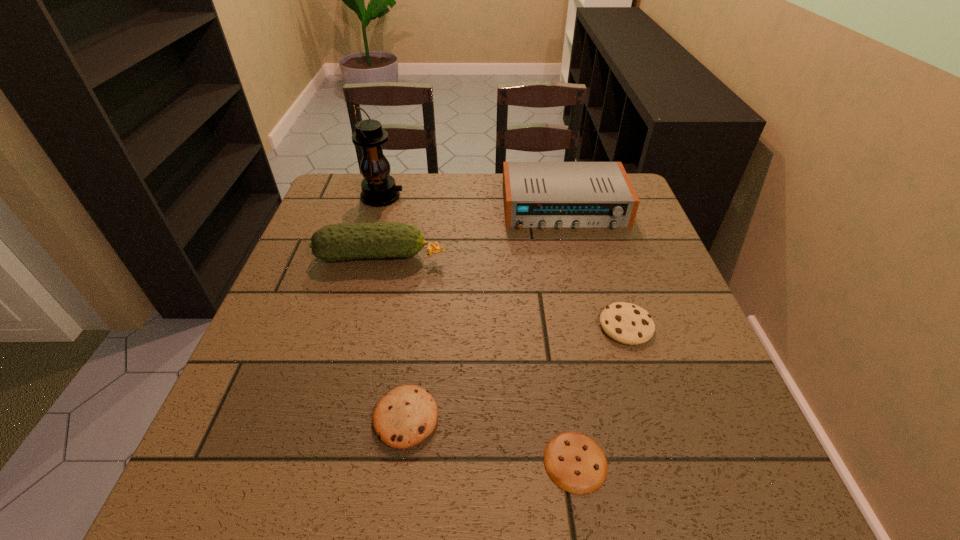
Image resolution: width=960 pixels, height=540 pixels. Find the location of `blank region between the third farthest object and the shortest object`. blank region between the third farthest object and the shortest object is located at coordinates (478, 360).

The width and height of the screenshot is (960, 540). I want to click on free point between the radio receiver and the second cookie from left to right, so click(569, 335).

Locate an element on the screen. This screenshot has height=540, width=960. free space between the lantern and the radio receiver is located at coordinates (473, 202).

You are a GUI agent. You are given a task and a screenshot of the screen. Output one action in this format:
    pyautogui.click(x=<x>, y=<y>)
    Task: Click on the free space between the shortest cookie and the radio receiver
    
    Given the screenshot: What is the action you would take?
    pyautogui.click(x=569, y=335)

Find the location of `vacant space that's between the radio receiver and the shortest object`. vacant space that's between the radio receiver and the shortest object is located at coordinates (569, 335).

Image resolution: width=960 pixels, height=540 pixels. Identify the location of free space between the radio receiver and the fourth farthest object. (595, 267).

Identify the location of vacant point located between the fifth tallest object and the radio receiver. (485, 313).

Locate an element on the screen. Image resolution: width=960 pixels, height=540 pixels. vacant space in between the radio receiver and the third nearest object is located at coordinates 595,267.

Where is `unoccupied position between the shortest object and the cucumber`? Image resolution: width=960 pixels, height=540 pixels. unoccupied position between the shortest object and the cucumber is located at coordinates (478, 360).

Choose which object is the third nearest neighbor to the lantern. Please provide its 2D coordinates. Your answer should be formatted as a tuple, i.e. [(x, y)], where the tuple contains the x and y coordinates of a point satisfying the conditions above.

[(407, 415)]